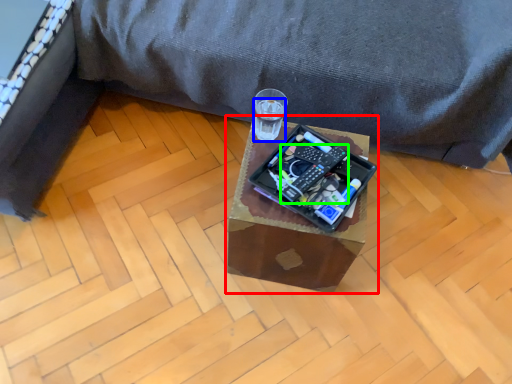
Question: Based on their relative distances, which object is farther from table (highlighted by a red box)? Choose from beverage (highlighted by a blue box) and gadget (highlighted by a green box).

Choices:
 (A) beverage
 (B) gadget

Answer: (A)